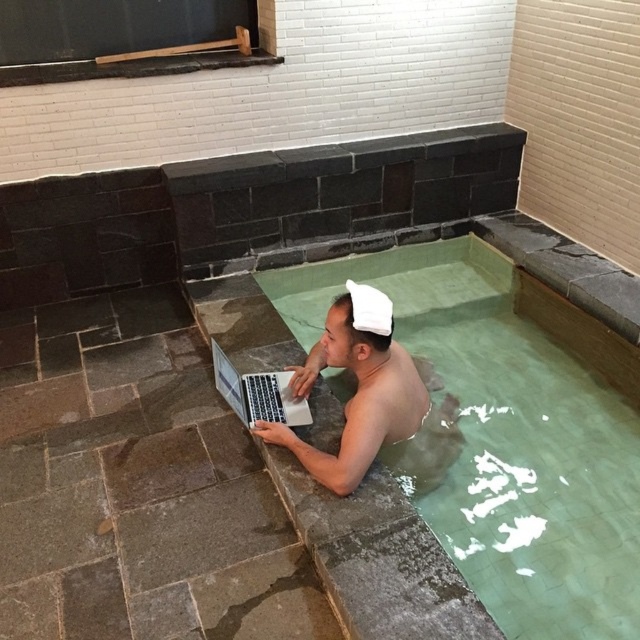
Can you confirm if green smooth stone pool at center is positioned below white fabric baseball hat at upper center?

Indeed, green smooth stone pool at center is positioned under white fabric baseball hat at upper center.

Does green smooth stone pool at center appear on the left side of white fabric baseball hat at upper center?

In fact, green smooth stone pool at center is to the right of white fabric baseball hat at upper center.

Who is more distant from viewer, (x=502, y=342) or (x=374, y=326)?

Point (x=502, y=342)

Identify the location of green smooth stone pool at center. (502, 440).

Looking at this image, does green smooth stone pool at center appear over silver metallic laptop at center?

Correct, green smooth stone pool at center is located above silver metallic laptop at center.

This screenshot has width=640, height=640. In order to click on green smooth stone pool at center in this screenshot , I will do `click(502, 440)`.

Is point (310, 461) closer to camera compared to point (243, 397)?

That is True.

Which is in front, point (296, 449) or point (300, 408)?

Point (296, 449)

In order to click on silver metallic laptop at center in this screenshot , I will do `click(356, 388)`.